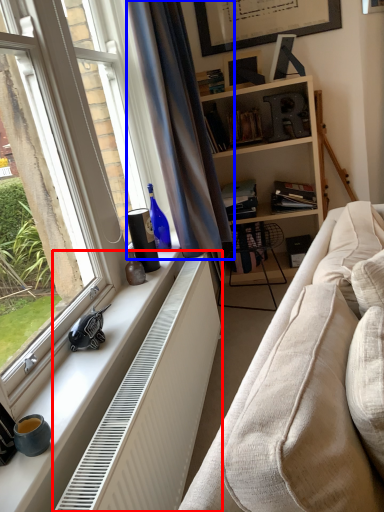
Question: Which point is closer to the camera, radiator (highlighted by a red box) or curtain (highlighted by a blue box)?

Choices:
 (A) radiator
 (B) curtain

Answer: (A)